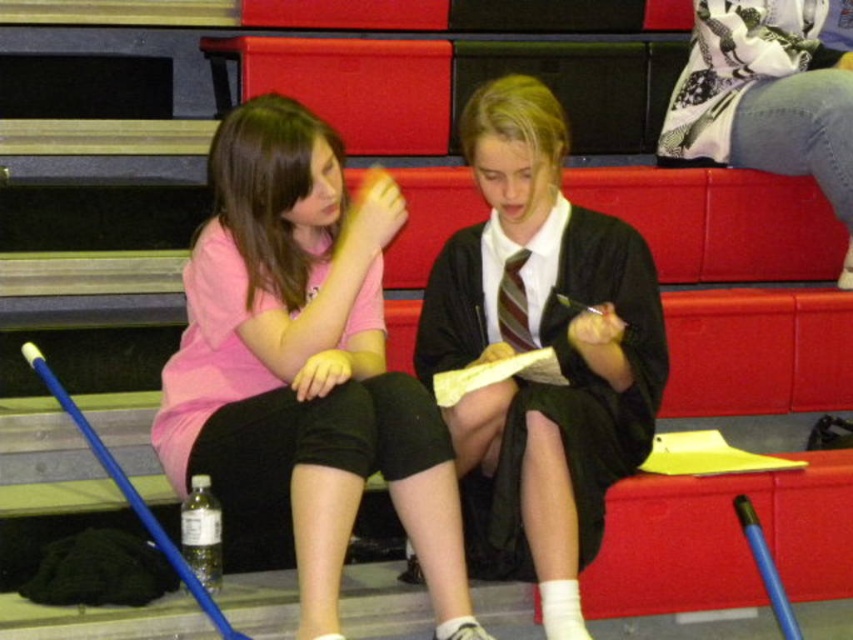
Question: Is pink fabric shirt at left positioned before matte black robe at center?

Choices:
 (A) yes
 (B) no

Answer: (A)

Question: Which point is farther to the camera?

Choices:
 (A) matte black robe at center
 (B) pink fabric shirt at left

Answer: (A)

Question: Which of the following is the closest to the observer?

Choices:
 (A) matte black robe at center
 (B) pink fabric shirt at left

Answer: (B)

Question: Is pink fabric shirt at left further to the viewer compared to matte black robe at center?

Choices:
 (A) no
 (B) yes

Answer: (A)

Question: Can you confirm if pink fabric shirt at left is bigger than matte black robe at center?

Choices:
 (A) no
 (B) yes

Answer: (B)